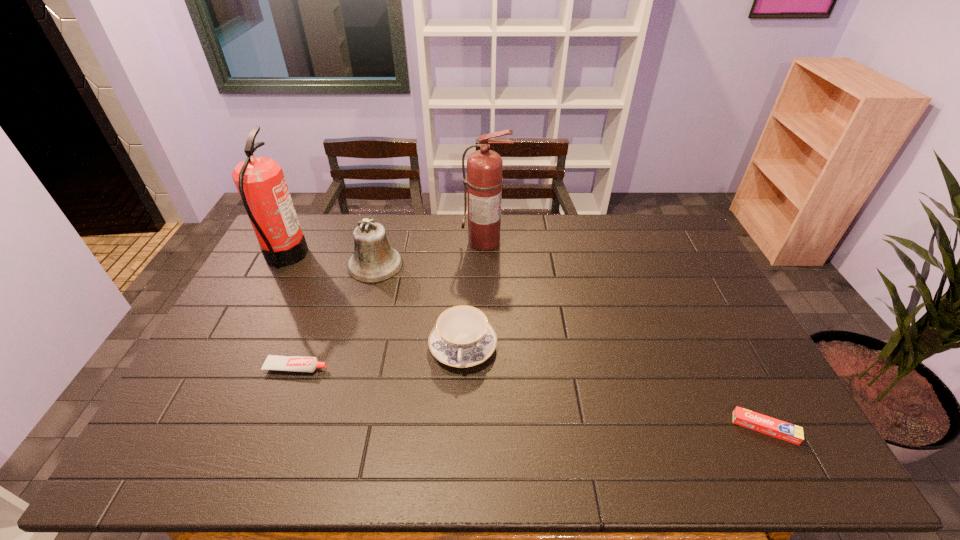
Where is `vacant region located 0.320m on the right of the bell`? This screenshot has height=540, width=960. vacant region located 0.320m on the right of the bell is located at coordinates (494, 265).

Find the location of `free space located 0.100m with the handle on the side of the third shortest object`. free space located 0.100m with the handle on the side of the third shortest object is located at coordinates [x=461, y=409].

Locate an element on the screen. This screenshot has height=540, width=960. vacant area situated on the back of the farther toothpaste is located at coordinates (310, 332).

The height and width of the screenshot is (540, 960). I want to click on vacant area situated on the left of the nearest object, so click(630, 428).

Locate an element on the screen. bell that is positioned at the far edge is located at coordinates (373, 261).

Where is `object located in the near edge section of the desktop`? object located in the near edge section of the desktop is located at coordinates (792, 433).

Locate an element on the screen. The image size is (960, 540). object that is at the left edge is located at coordinates (261, 184).

This screenshot has width=960, height=540. In order to click on object at the right edge in this screenshot , I will do `click(792, 433)`.

I want to click on object at the far left corner, so click(x=261, y=184).

Find the location of a particular element. object positioned at the near right corner is located at coordinates (792, 433).